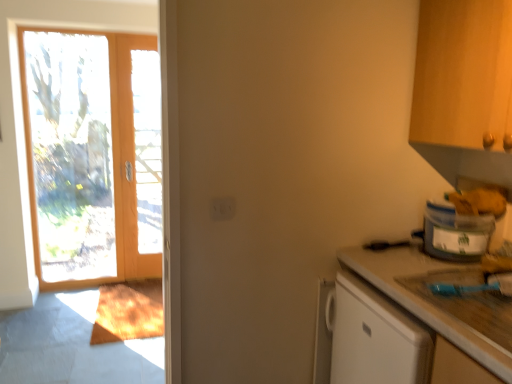
Question: From the image's perspective, is matte wooden screen door at left above or below smooth beige countertop at lower right?

Choices:
 (A) below
 (B) above

Answer: (B)

Question: Is matte wooden screen door at left inside or outside of smooth beige countertop at lower right?

Choices:
 (A) outside
 (B) inside

Answer: (A)

Question: Estimate the real-world distances between objects in this image. Which object is closer to the matte wooden screen door at left?

Choices:
 (A) smooth beige countertop at lower right
 (B) translucent plastic container at right
 (C) clear glass door at left

Answer: (C)

Question: Which object is positioned farthest from the smooth beige countertop at lower right?

Choices:
 (A) translucent plastic container at right
 (B) clear glass door at left
 (C) matte wooden screen door at left

Answer: (B)